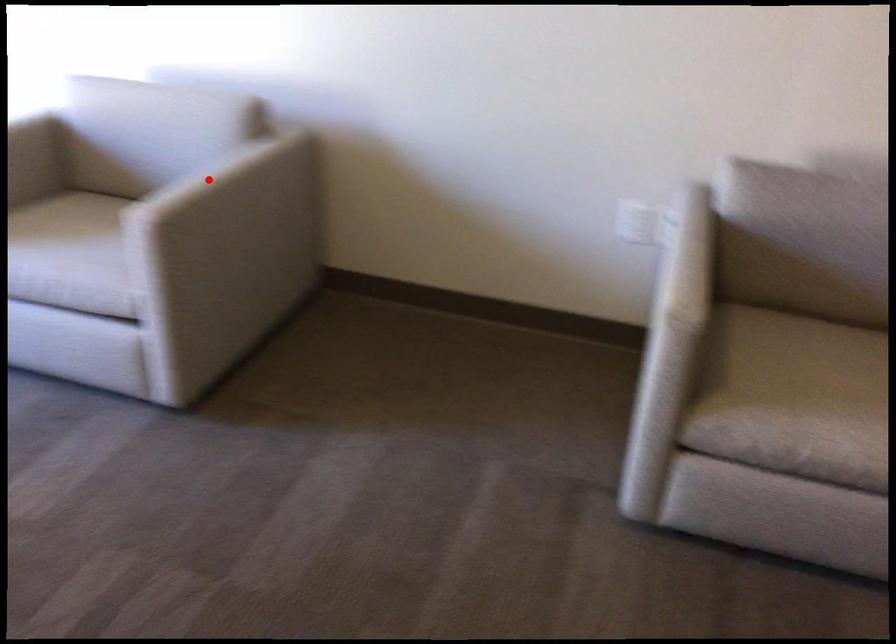
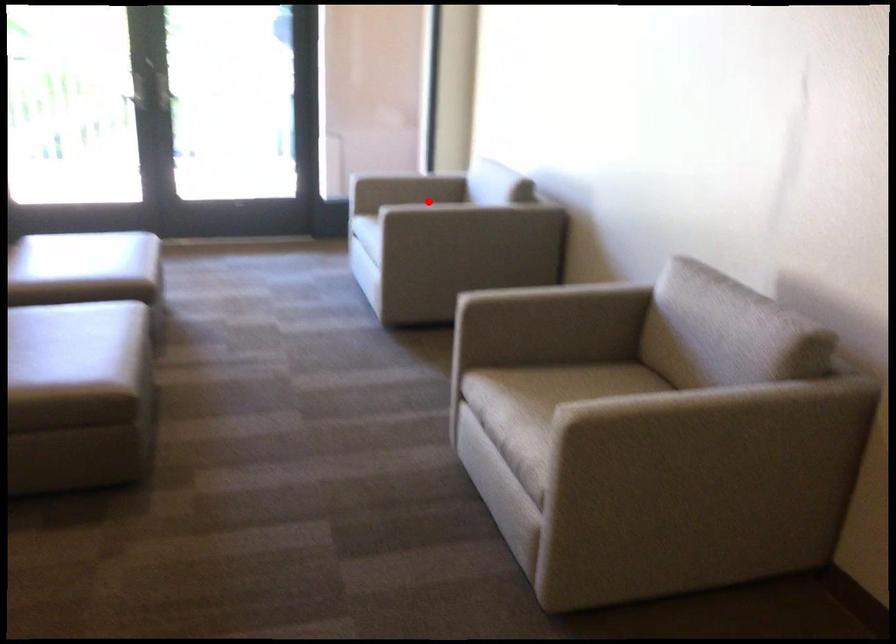
I am providing you with two images of the same scene from different viewpoints. A red point is marked on the first image and another point is marked on the second image. Is the marked point in image1 the same physical position as the marked point in image2?

Yes